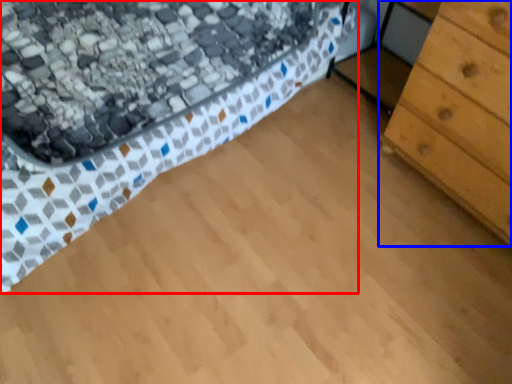
Question: Which object is closer to the camera taking this photo, bed (highlighted by a red box) or chest of drawers (highlighted by a blue box)?

Choices:
 (A) bed
 (B) chest of drawers

Answer: (A)